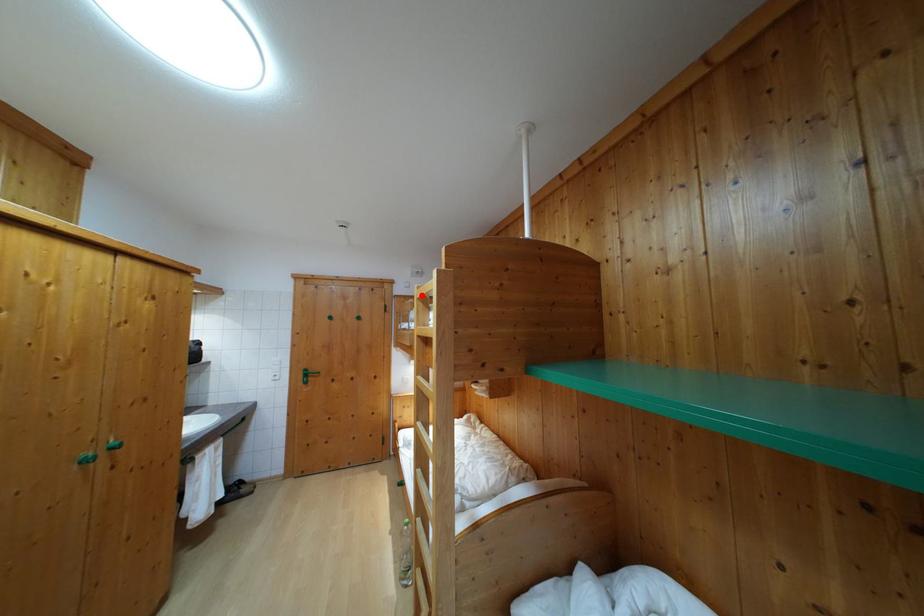
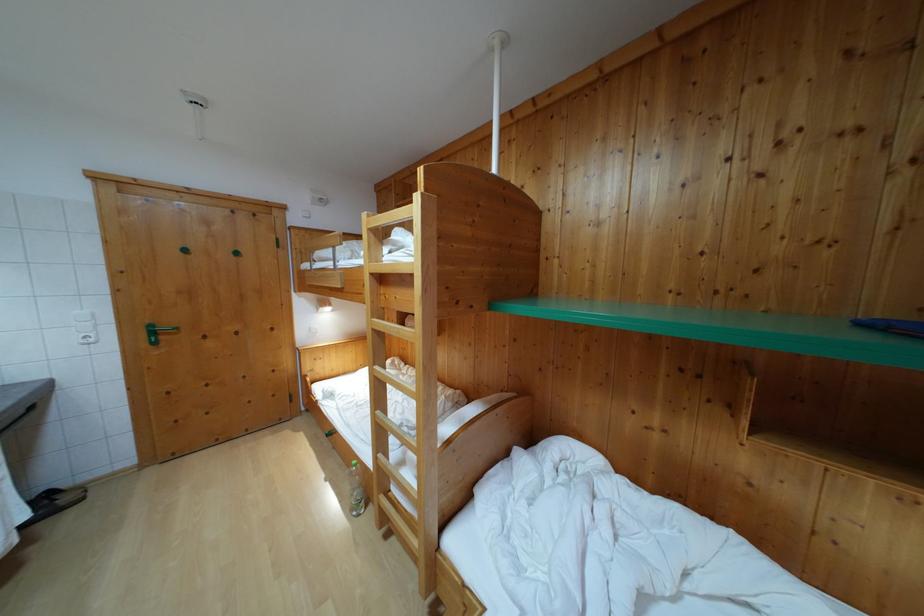
In the second image, find the point that corresponds to the highlighted location in the first image.

(371, 223)